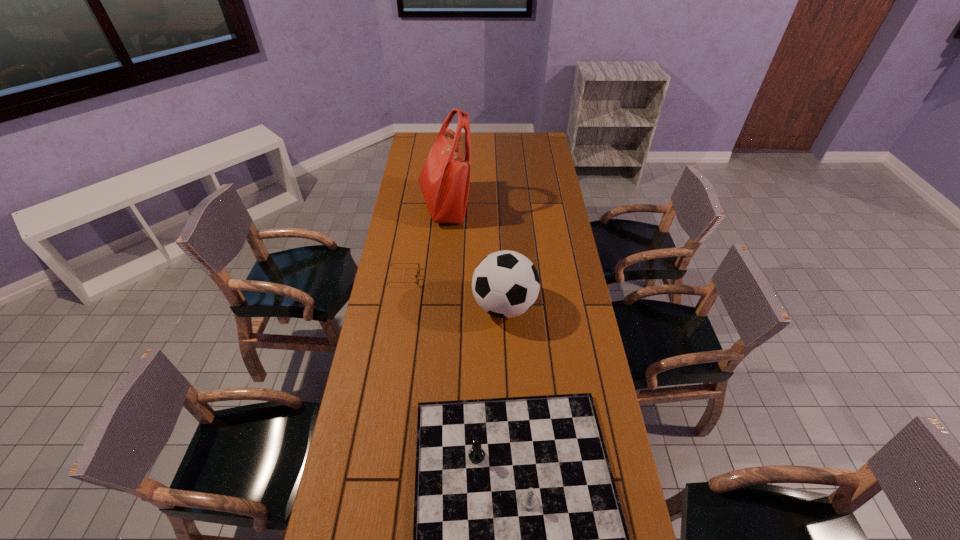
I want to click on free space that satisfies the following two spatial constraints: 1. on the front-facing side of the second tallest object; 2. on the left side of the sunglasses, so click(x=399, y=306).

Locate an element on the screen. The height and width of the screenshot is (540, 960). free spot that satisfies the following two spatial constraints: 1. on the front-facing side of the sunglasses; 2. on the back side of the second tallest object is located at coordinates (399, 306).